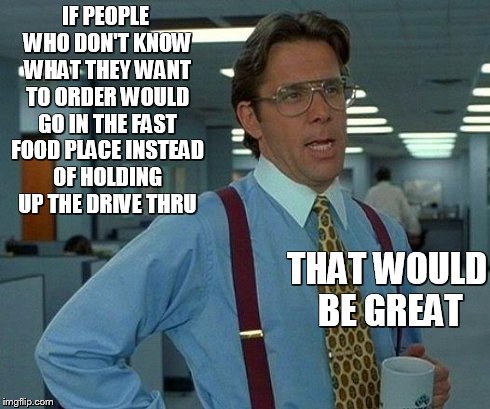
Where is `mug`? mug is located at coordinates (408, 383).